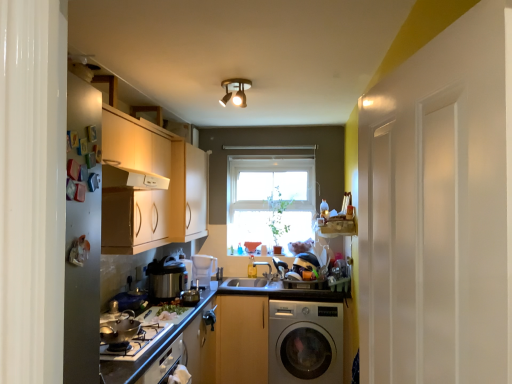
Describe the element at coordinates (136, 343) in the screenshot. I see `silver metallic gas stove at lower left` at that location.

This screenshot has height=384, width=512. I want to click on gold metallic spotlight at center, so click(234, 91).

What do you see at coordinates (149, 350) in the screenshot? I see `matte white countertop at lower left` at bounding box center [149, 350].

The image size is (512, 384). What are the coordinates of `white glossy cabinet at upper center, the first cabinetry from the top` in the screenshot? It's located at (187, 192).

Is silver metallic washing machine at lower right next to shiny silver wok at lower left, marked as the 2th appliance in a right-to-left arrangement, and touching it?

No, silver metallic washing machine at lower right is not touching shiny silver wok at lower left, marked as the 2th appliance in a right-to-left arrangement.

From a real-world perspective, which object stands above the other?

shiny silver wok at lower left, acting as the second appliance starting from the back.

Is silver metallic washing machine at lower right wider than shiny silver wok at lower left, marked as the first appliance in a front-to-back arrangement?

Indeed, silver metallic washing machine at lower right has a greater width compared to shiny silver wok at lower left, marked as the first appliance in a front-to-back arrangement.

Is point (298, 327) positioned after point (131, 324)?

Yes, point (298, 327) is behind point (131, 324).

From the image's perspective, is white plastic pitcher at center, which is the second appliance in front-to-back order, above or below metallic pressure cooker at center?

white plastic pitcher at center, which is the second appliance in front-to-back order, is situated lower than metallic pressure cooker at center in the image.

Considering the relative sizes of white plastic pitcher at center, which appears as the second appliance when viewed from the left, and metallic pressure cooker at center in the image provided, is white plastic pitcher at center, which appears as the second appliance when viewed from the left, thinner than metallic pressure cooker at center?

Correct, the width of white plastic pitcher at center, which appears as the second appliance when viewed from the left, is less than that of metallic pressure cooker at center.

Consider the image. Is white plastic pitcher at center, which is the second appliance in front-to-back order, not inside metallic pressure cooker at center?

Yes, white plastic pitcher at center, which is the second appliance in front-to-back order, is not within metallic pressure cooker at center.

Consider the image. Is the surface of silver metallic washing machine at lower right in direct contact with gold metallic spotlight at center?

No.

Considering the relative positions of silver metallic washing machine at lower right and gold metallic spotlight at center in the image provided, is silver metallic washing machine at lower right to the left or to the right of gold metallic spotlight at center?

In the image, silver metallic washing machine at lower right appears on the right side of gold metallic spotlight at center.

Where is `light fixture above the silver metallic washing machine at lower right (from the image's perspective)`? This screenshot has width=512, height=384. light fixture above the silver metallic washing machine at lower right (from the image's perspective) is located at coordinates (234, 91).

Between silver metallic washing machine at lower right and gold metallic spotlight at center, which one has smaller size?

With smaller size is gold metallic spotlight at center.

In the scene shown: How different are the orientations of metallic pressure cooker at center and gold metallic spotlight at center in degrees?

The facing directions of metallic pressure cooker at center and gold metallic spotlight at center are 101 degrees apart.

Are metallic pressure cooker at center and gold metallic spotlight at center making contact?

There is a gap between metallic pressure cooker at center and gold metallic spotlight at center.

Based on their sizes in the image, would you say metallic pressure cooker at center is bigger or smaller than gold metallic spotlight at center?

In the image, metallic pressure cooker at center appears to be larger than gold metallic spotlight at center.

Is metallic pressure cooker at center facing towards gold metallic spotlight at center?

No, metallic pressure cooker at center is not aimed at gold metallic spotlight at center.

From the picture: Who is shorter, white plastic pitcher at center, which is the first appliance from back to front, or white glossy cabinet at upper center, the first cabinetry from the top?

white plastic pitcher at center, which is the first appliance from back to front.

How many degrees apart are the facing directions of white plastic pitcher at center, which is the first appliance from back to front, and white glossy cabinet at upper center, the 2th cabinetry when ordered from bottom to top?

52.9 degrees.

Is white plastic pitcher at center, which appears as the second appliance when viewed from the left, further to camera compared to white glossy cabinet at upper center, placed as the 1th cabinetry when sorted from left to right?

Yes, white plastic pitcher at center, which appears as the second appliance when viewed from the left, is further from the viewer.

Considering the positions of point (200, 276) and point (236, 95), is point (200, 276) closer or farther from the camera than point (236, 95)?

Point (200, 276) appears to be farther away from the viewer than point (236, 95).

Are white plastic pitcher at center, positioned as the 1th appliance in right-to-left order, and gold metallic spotlight at center making contact?

No, white plastic pitcher at center, positioned as the 1th appliance in right-to-left order, is not beside gold metallic spotlight at center.

From a real-world perspective, between white plastic pitcher at center, positioned as the 1th appliance in right-to-left order, and gold metallic spotlight at center, who is vertically lower?

In real-world perspective, white plastic pitcher at center, positioned as the 1th appliance in right-to-left order, is lower.

How different are the orientations of shiny silver wok at lower left, the 1th appliance from the left, and wooden cabinet at center, marked as the first cabinetry in a bottom-to-top arrangement, in degrees?

They differ by 94.3 degrees in their facing directions.

Is shiny silver wok at lower left, acting as the second appliance starting from the back, looking in the opposite direction of wooden cabinet at center, acting as the second cabinetry starting from the top?

No.

In terms of size, does shiny silver wok at lower left, the 1th appliance from the left, appear bigger or smaller than wooden cabinet at center, marked as the first cabinetry in a bottom-to-top arrangement?

In the image, shiny silver wok at lower left, the 1th appliance from the left, appears to be smaller than wooden cabinet at center, marked as the first cabinetry in a bottom-to-top arrangement.

At what (x,y) coordinates should I click in order to perform the action: click on cabinetry below the shiny silver wok at lower left, marked as the 2th appliance in a right-to-left arrangement (from the image's perspective). Please return your answer as a coordinate pair (x, y). This screenshot has height=384, width=512. Looking at the image, I should click on (241, 339).

At what (x,y) coordinates should I click in order to perform the action: click on washing machine that appears on the right of shiny silver wok at lower left, acting as the second appliance starting from the back. Please return your answer as a coordinate pair (x, y). Image resolution: width=512 pixels, height=384 pixels. Looking at the image, I should click on (305, 342).

The width and height of the screenshot is (512, 384). Identify the location of kitchen appliance located above the white plastic pitcher at center, which is the second appliance in front-to-back order (from the image's perspective). (166, 278).

Which object lies nearer to the anchor point smooth granite countertop at center, gold metallic spotlight at center or matte white countertop at lower left?

Based on the image, matte white countertop at lower left appears to be nearer to smooth granite countertop at center.

Looking at this image, when comparing their distances from smooth granite countertop at center, does metallic pressure cooker at center or silver metallic washing machine at lower right seem closer?

The object closer to smooth granite countertop at center is silver metallic washing machine at lower right.

From the image, which object appears to be farther from white plastic pitcher at center, which appears as the second appliance when viewed from the left, shiny silver wok at lower left, marked as the first appliance in a front-to-back arrangement, or wooden cabinet at center, acting as the second cabinetry starting from the top?

Based on the image, shiny silver wok at lower left, marked as the first appliance in a front-to-back arrangement, appears to be further to white plastic pitcher at center, which appears as the second appliance when viewed from the left.

Based on their spatial positions, is matte white countertop at lower left or white plastic pitcher at center, which is the first appliance from back to front, closer to white glossy cabinet at upper center, the 2th cabinetry when ordered from right to left?

The object closer to white glossy cabinet at upper center, the 2th cabinetry when ordered from right to left, is white plastic pitcher at center, which is the first appliance from back to front.

When comparing their distances from gold metallic spotlight at center, does wooden cabinet at center, arranged as the first cabinetry when viewed from the right, or metallic pressure cooker at center seem further?

wooden cabinet at center, arranged as the first cabinetry when viewed from the right, is further to gold metallic spotlight at center.

When comparing their distances from silver metallic gas stove at lower left, does white plastic pitcher at center, which is the first appliance from back to front, or white glossy cabinet at upper center, the first cabinetry from the top, seem further?

white plastic pitcher at center, which is the first appliance from back to front, lies further to silver metallic gas stove at lower left than the other object.

When comparing their distances from silver metallic gas stove at lower left, does wooden cabinet at center, acting as the second cabinetry starting from the top, or metallic pressure cooker at center seem closer?

Based on the image, metallic pressure cooker at center appears to be nearer to silver metallic gas stove at lower left.

Estimate the real-world distances between objects in this image. Which object is further from clear glass window at center, matte white countertop at lower left or white glossy cabinet at upper center, placed as the 1th cabinetry when sorted from left to right?

Based on the image, matte white countertop at lower left appears to be further to clear glass window at center.

This screenshot has width=512, height=384. Find the location of `kitchen appliance between shiny silver wok at lower left, the 1th appliance from the left, and silver metallic washing machine at lower right in the front-back direction`. kitchen appliance between shiny silver wok at lower left, the 1th appliance from the left, and silver metallic washing machine at lower right in the front-back direction is located at coordinates (166, 278).

Image resolution: width=512 pixels, height=384 pixels. I want to click on cabinetry between gold metallic spotlight at center and white plastic pitcher at center, which is the first appliance from back to front, in the vertical direction, so click(187, 192).

Where is `window between white glossy cabinet at upper center, the 2th cabinetry when ordered from right to left, and silver metallic washing machine at lower right, in the vertical direction`? window between white glossy cabinet at upper center, the 2th cabinetry when ordered from right to left, and silver metallic washing machine at lower right, in the vertical direction is located at coordinates (270, 199).

Where is `gas stove between matte white countertop at lower left and white glossy cabinet at upper center, placed as the 1th cabinetry when sorted from left to right, in the front-back direction`? The height and width of the screenshot is (384, 512). gas stove between matte white countertop at lower left and white glossy cabinet at upper center, placed as the 1th cabinetry when sorted from left to right, in the front-back direction is located at coordinates (136, 343).